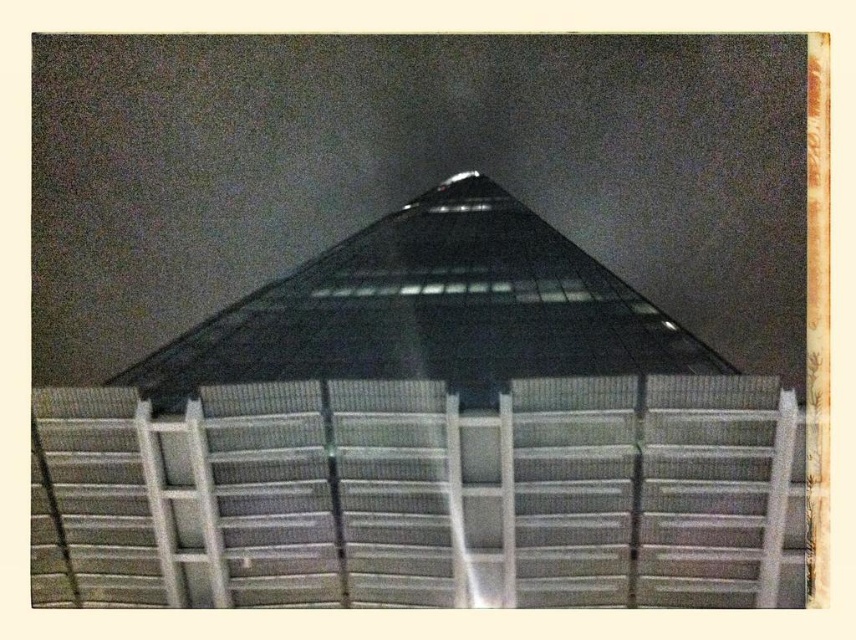
You are standing in front of the building and want to take a photo of the transparent glass roof at center without the metallic grid at center blocking the view. Is it possible to do so?

The metallic grid at center is in front of the transparent glass roof at center, so it will block the view. You cannot take a photo of the transparent glass roof at center without the metallic grid at center blocking the view.

You are a maintenance worker standing at the entrance of the building. You need to check the distance between the metallic grid at center and the transparent glass roof at center. Can you safely walk between them without any obstruction?

The metallic grid at center is 4.24 meters away from the transparent glass roof at center, so yes, you can safely walk between them without any obstruction as the distance is sufficient.

You are an architect analyzing the building structure. You notice the metallic grid at center and the transparent glass roof at center. Which object is located to the left of the other?

The metallic grid at center is positioned on the left side of transparent glass roof at center.